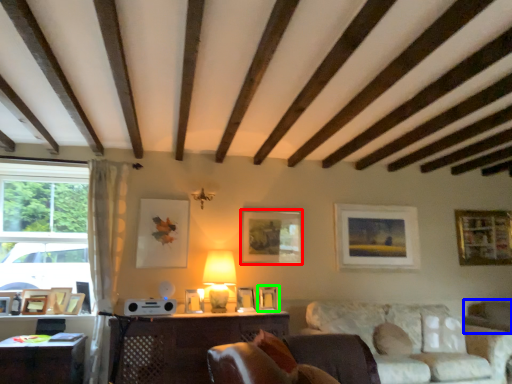
Question: Considering the real-world distances, which object is farthest from picture frame (highlighted by a red box)? swivel chair (highlighted by a blue box) or picture frame (highlighted by a green box)?

Choices:
 (A) swivel chair
 (B) picture frame

Answer: (A)